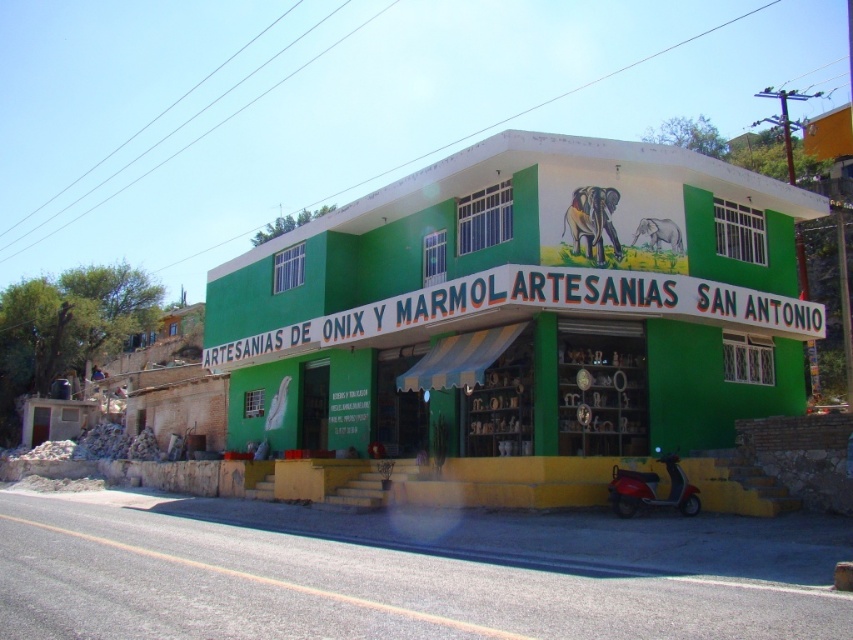
Is green matte building at center smaller than metallic red scooter at lower right?

Actually, green matte building at center might be larger than metallic red scooter at lower right.

Describe the element at coordinates (523, 314) in the screenshot. I see `green matte building at center` at that location.

Locate an element on the screen. The image size is (853, 640). green matte building at center is located at coordinates (523, 314).